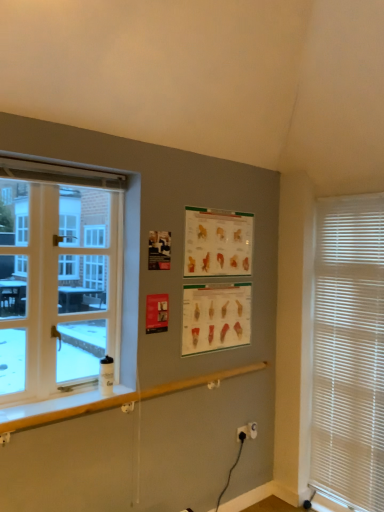
Question: Is there a large distance between black plastic electric outlet at lower center, which is the 1th electric outlet from left to right, and white plastic electric outlet at lower center, the first electric outlet from the right?

Choices:
 (A) yes
 (B) no

Answer: (B)

Question: Is black plastic electric outlet at lower center, which is the 1th electric outlet from left to right, wider than white plastic electric outlet at lower center, the first electric outlet from the right?

Choices:
 (A) yes
 (B) no

Answer: (B)

Question: Is black plastic electric outlet at lower center, the 3th electric outlet viewed from the right, taller than white plastic electric outlet at lower center, the first electric outlet from the right?

Choices:
 (A) no
 (B) yes

Answer: (A)

Question: Does black plastic electric outlet at lower center, the 3th electric outlet viewed from the right, have a larger size compared to white plastic electric outlet at lower center, the first electric outlet from the right?

Choices:
 (A) no
 (B) yes

Answer: (A)

Question: Is black plastic electric outlet at lower center, the 3th electric outlet viewed from the right, aimed at white plastic electric outlet at lower center, acting as the 3th electric outlet starting from the left?

Choices:
 (A) no
 (B) yes

Answer: (A)

Question: Considering the relative sizes of black plastic electric outlet at lower center, which is the 1th electric outlet from left to right, and white plastic electric outlet at lower center, acting as the 3th electric outlet starting from the left, in the image provided, is black plastic electric outlet at lower center, which is the 1th electric outlet from left to right, shorter than white plastic electric outlet at lower center, acting as the 3th electric outlet starting from the left,?

Choices:
 (A) no
 (B) yes

Answer: (B)

Question: From the image's perspective, is black plastic electric outlet at lower right, the second electric outlet from the right, under matte paper poster at center, which is the 1th poster page from bottom to top?

Choices:
 (A) no
 (B) yes

Answer: (B)

Question: Is the position of black plastic electric outlet at lower right, the second electric outlet from the right, less distant than that of matte paper poster at center, which is the 2th poster page in top-to-bottom order?

Choices:
 (A) no
 (B) yes

Answer: (A)

Question: Are black plastic electric outlet at lower right, acting as the second electric outlet starting from the left, and matte paper poster at center, which is the 1th poster page from bottom to top, making contact?

Choices:
 (A) no
 (B) yes

Answer: (A)

Question: Is black plastic electric outlet at lower right, acting as the second electric outlet starting from the left, positioned behind matte paper poster at center, which is the 2th poster page in top-to-bottom order?

Choices:
 (A) no
 (B) yes

Answer: (B)

Question: Does black plastic electric outlet at lower right, acting as the second electric outlet starting from the left, have a larger size compared to matte paper poster at center, which is the 2th poster page in top-to-bottom order?

Choices:
 (A) yes
 (B) no

Answer: (B)

Question: Is black plastic electric outlet at lower right, the second electric outlet from the right, at the left side of matte paper poster at center, which is the 1th poster page from bottom to top?

Choices:
 (A) yes
 (B) no

Answer: (B)

Question: Does matte paper poster at center, which is the 2th poster page in top-to-bottom order, come in front of matte paper poster at upper center, acting as the first poster page starting from the top?

Choices:
 (A) yes
 (B) no

Answer: (B)